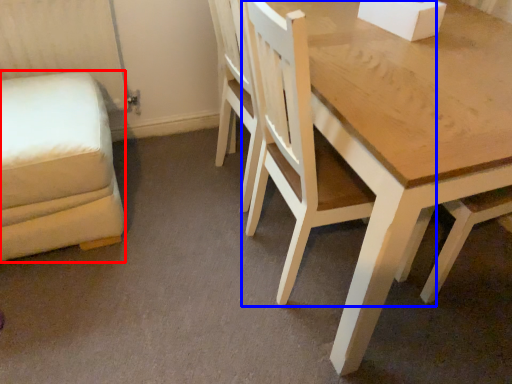
Question: Which point is further to the camera, swivel chair (highlighted by a red box) or chair (highlighted by a blue box)?

Choices:
 (A) swivel chair
 (B) chair

Answer: (A)